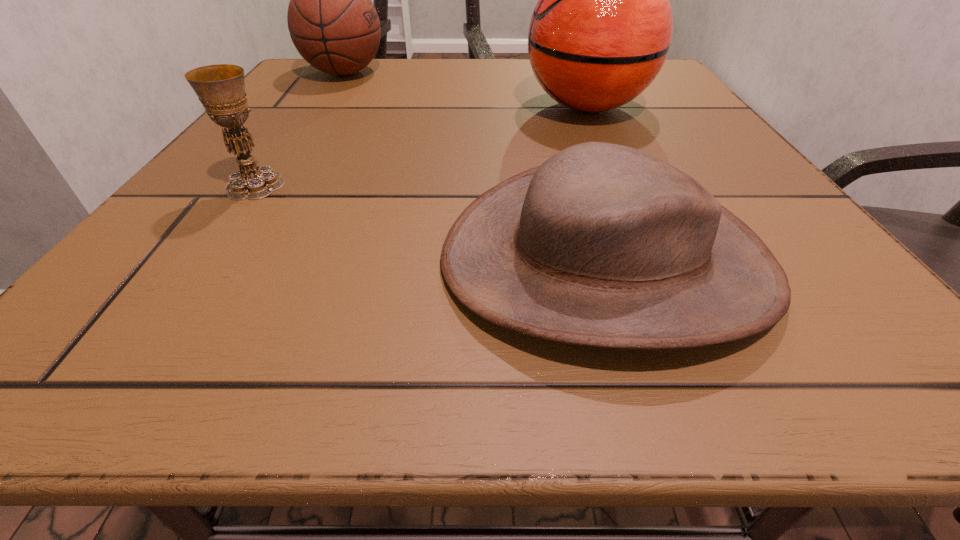
At what (x,y) coordinates should I click in order to perform the action: click on vacant space situated on the back of the shortest object. Please return your answer as a coordinate pair (x, y). This screenshot has width=960, height=540. Looking at the image, I should click on (551, 87).

Where is `object at the near edge`? object at the near edge is located at coordinates [603, 245].

You are a GUI agent. You are given a task and a screenshot of the screen. Output one action in this format:
    pyautogui.click(x=<x>, y=<y>)
    Task: Click on the basketball situated at the left edge
    This screenshot has height=540, width=960.
    Given the screenshot: What is the action you would take?
    pyautogui.click(x=333, y=24)

Where is `chalice that is at the left edge`? Image resolution: width=960 pixels, height=540 pixels. chalice that is at the left edge is located at coordinates (220, 88).

Locate an element on the screen. The width and height of the screenshot is (960, 540). basketball present at the right edge is located at coordinates (x=600, y=33).

Locate an element on the screen. cowboy hat present at the right edge is located at coordinates (603, 245).

This screenshot has width=960, height=540. In order to click on object that is at the far left corner in this screenshot , I will do `click(333, 24)`.

The width and height of the screenshot is (960, 540). I want to click on object situated at the far right corner, so click(x=600, y=33).

You are a GUI agent. You are given a task and a screenshot of the screen. Output one action in this format:
    pyautogui.click(x=<x>, y=<y>)
    Task: Click on the object that is at the near right corner
    
    Given the screenshot: What is the action you would take?
    pyautogui.click(x=603, y=245)

In the image, there is a desktop. Identify the location of vacant space at the far edge. The width and height of the screenshot is (960, 540). (524, 58).